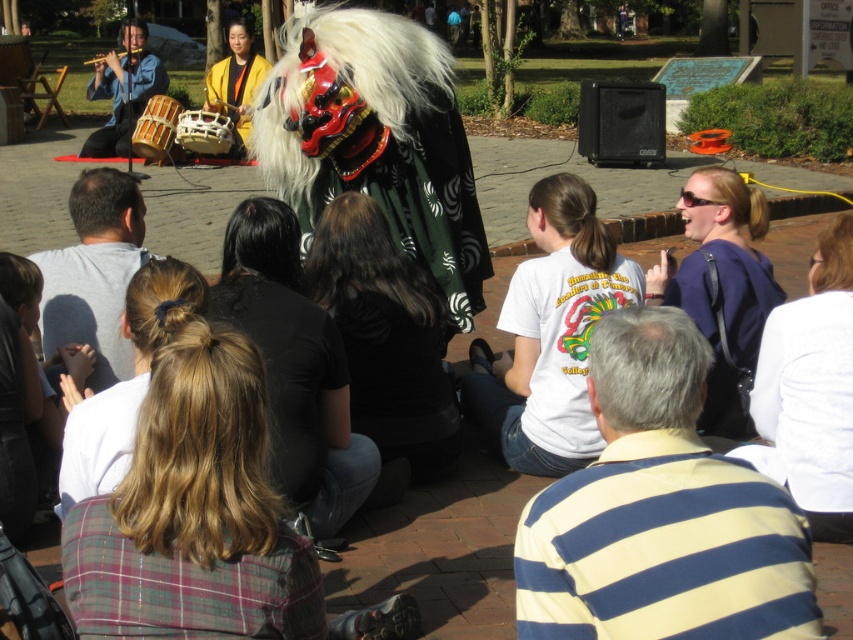
Question: Can you confirm if black matte mask at center is positioned to the right of gray cotton shirt at center?

Choices:
 (A) no
 (B) yes

Answer: (B)

Question: Which is farther from the matte blue shirt at center?

Choices:
 (A) brushed metal flute at upper left
 (B) yellow fabric drum at upper center
 (C) white cotton shirt at lower right

Answer: (A)

Question: Estimate the real-world distances between objects in this image. Which object is closer to the matte blue shirt at upper left?

Choices:
 (A) brushed metal flute at upper left
 (B) plaid fabric shirt at lower left
 (C) striped cotton shirt at center
 (D) white cotton shirt at lower right

Answer: (A)

Question: Which of the following is the closest to the observer?

Choices:
 (A) brushed metal flute at upper left
 (B) striped cotton shirt at center
 (C) matte black costume at center

Answer: (B)

Question: Considering the relative positions of striped cotton shirt at center and gray cotton shirt at center in the image provided, where is striped cotton shirt at center located with respect to gray cotton shirt at center?

Choices:
 (A) left
 (B) right

Answer: (B)

Question: Does white cotton shirt at lower right lie in front of yellow fabric drum at upper center?

Choices:
 (A) yes
 (B) no

Answer: (A)